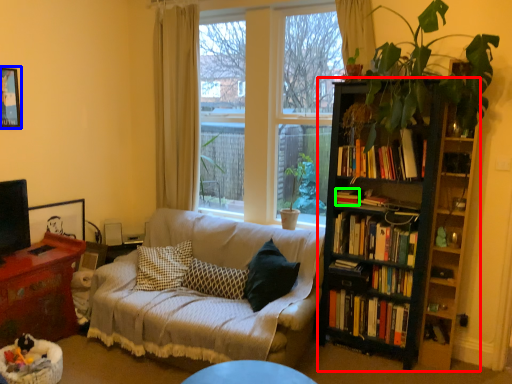
Question: Which object is positioned farthest from bookcase (highlighted by a red box)? Select from picture frame (highlighted by a blue box) and book (highlighted by a green box).

Choices:
 (A) picture frame
 (B) book

Answer: (A)